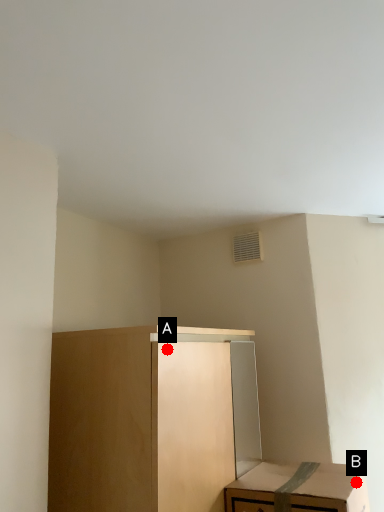
Question: Two points are circled on the image, labeled by A and B beside each circle. Which point is closer to the camera?

Choices:
 (A) A is closer
 (B) B is closer

Answer: (A)